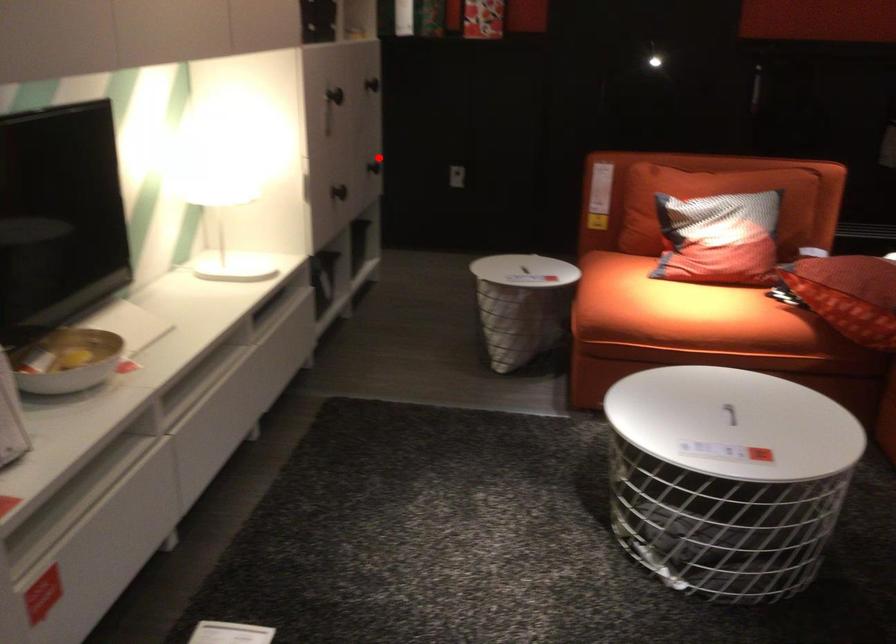
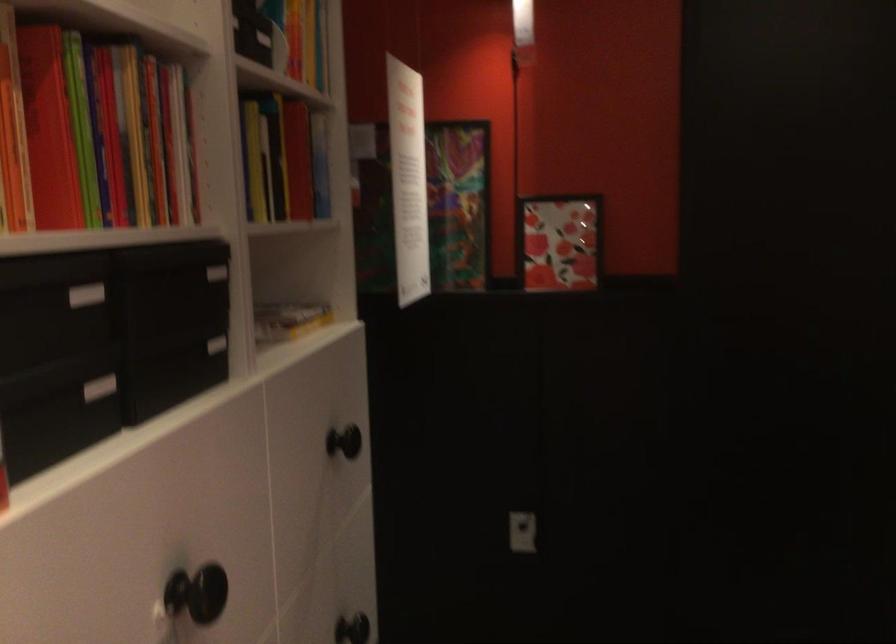
In the second image, find the point that corresponds to the highlighted location in the first image.

(351, 629)